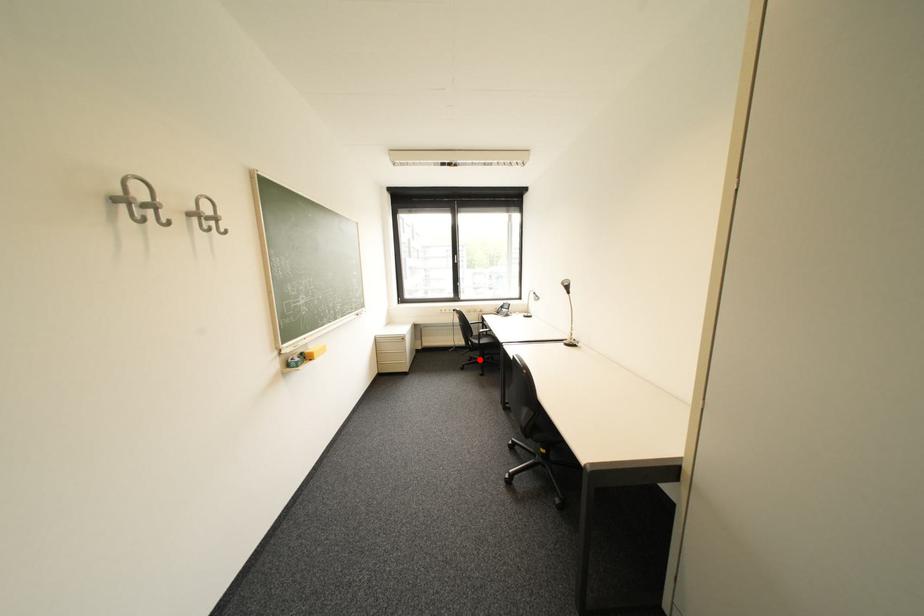
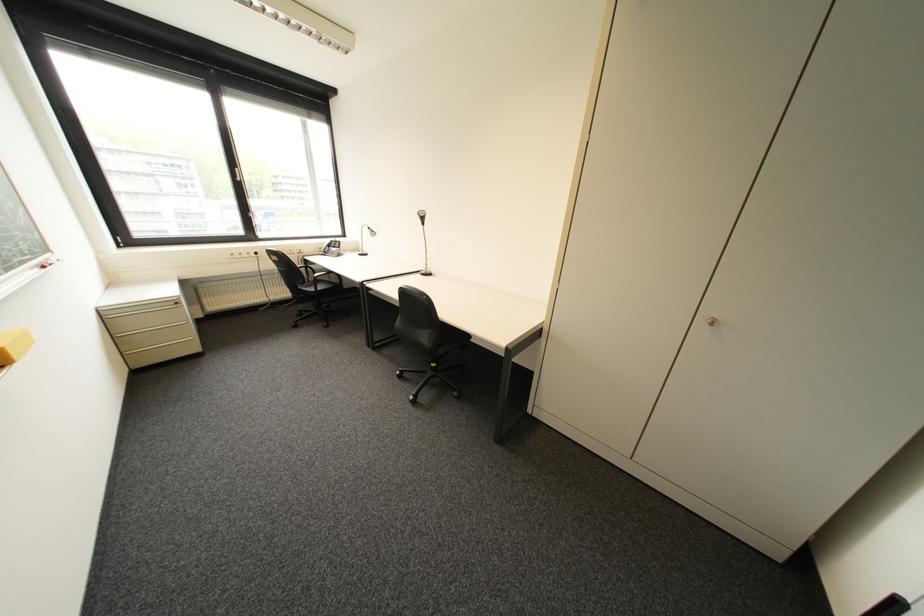
In the second image, find the point that corresponds to the highlighted location in the first image.

(309, 314)